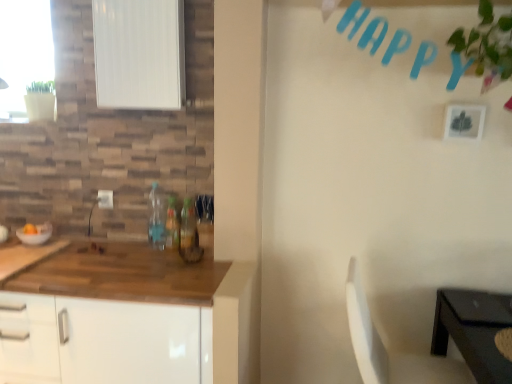
Locate an element on the screen. vacant area that is in front of white glossy bowl at left is located at coordinates (25, 256).